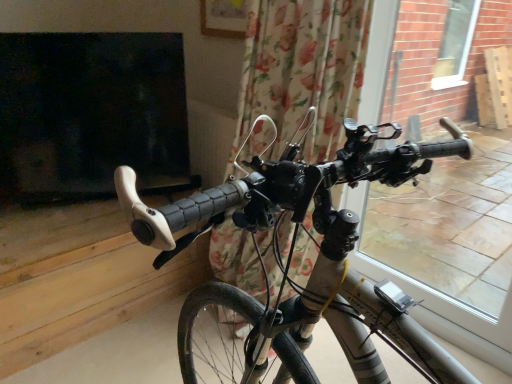
Question: Is transparent glass window at right wider or thinner than floral fabric curtain at center?

Choices:
 (A) thin
 (B) wide

Answer: (A)

Question: Considering the positions of transparent glass window at right and floral fabric curtain at center in the image, is transparent glass window at right taller or shorter than floral fabric curtain at center?

Choices:
 (A) tall
 (B) short

Answer: (A)

Question: Estimate the real-world distances between objects in this image. Which object is farther from the matte black handlebars at center?

Choices:
 (A) transparent glass window at right
 (B) floral fabric curtain at center

Answer: (A)

Question: Estimate the real-world distances between objects in this image. Which object is closer to the matte black handlebars at center?

Choices:
 (A) floral fabric curtain at center
 (B) transparent glass window at right

Answer: (A)